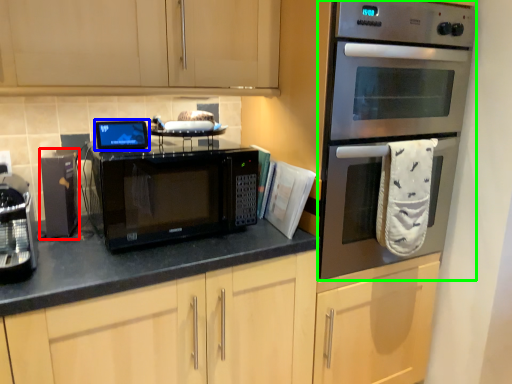
Question: Considering the real-world distances, which object is closest to appliance (highlighted by a red box)? appliance (highlighted by a blue box) or oven (highlighted by a green box).

Choices:
 (A) appliance
 (B) oven

Answer: (A)